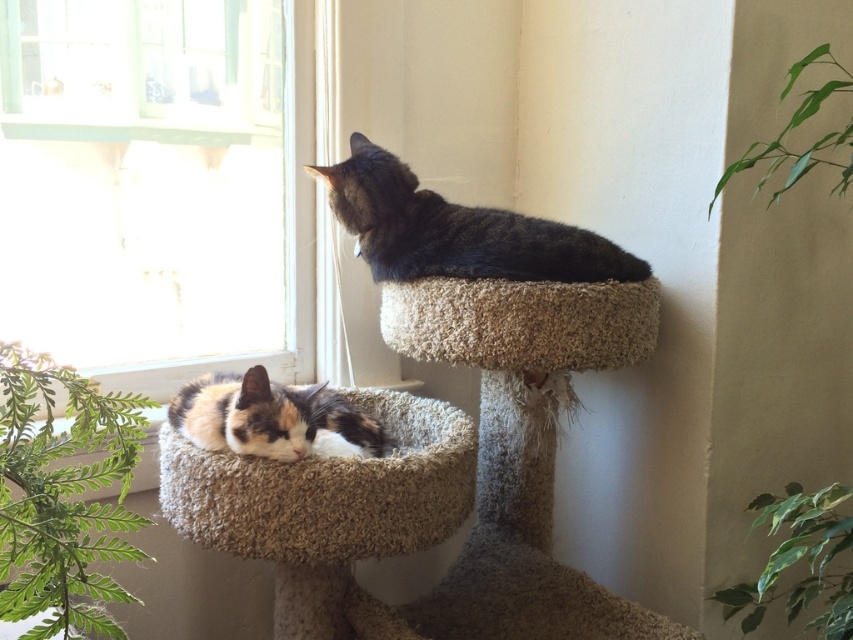
Is beige carpeted cat bed at lower left wider than calico fur cat at lower left?

Indeed, beige carpeted cat bed at lower left has a greater width compared to calico fur cat at lower left.

Which is in front, point (258, 554) or point (358, 426)?

Point (258, 554) is more forward.

Does point (386, 528) come farther from viewer compared to point (274, 385)?

No, (386, 528) is closer to viewer.

This screenshot has height=640, width=853. In order to click on beige carpeted cat bed at lower left in this screenshot , I will do `click(328, 490)`.

Does clear glass window at upper left have a greater width compared to calico fur cat at lower left?

Yes, clear glass window at upper left is wider than calico fur cat at lower left.

Is clear glass window at upper left closer to camera compared to calico fur cat at lower left?

No, clear glass window at upper left is further to the viewer.

Does point (114, 218) come farther from viewer compared to point (194, 400)?

Yes, point (114, 218) is behind point (194, 400).

Where is `clear glass window at upper left`? clear glass window at upper left is located at coordinates (154, 186).

Who is more forward, [54,202] or [502,244]?

Point [502,244]

Which is behind, point (276, 269) or point (358, 256)?

Positioned behind is point (276, 269).

Is point (44, 35) closer to camera compared to point (350, 177)?

Yes, point (44, 35) is closer to viewer.

At what (x,y) coordinates should I click in order to perform the action: click on clear glass window at upper left. Please return your answer as a coordinate pair (x, y). This screenshot has height=640, width=853. Looking at the image, I should click on (154, 186).